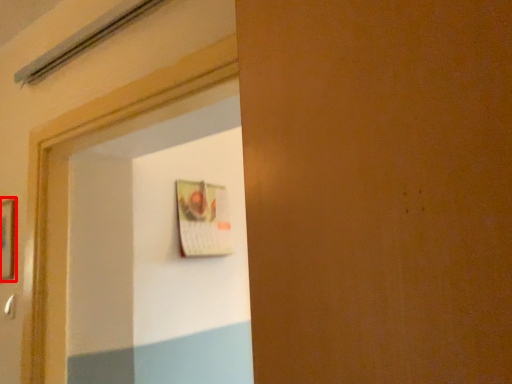
Question: From the image's perspective, considering the relative positions of picture frame (annotated by the red box) and door handle in the image provided, where is picture frame (annotated by the red box) located with respect to the staircase?

Choices:
 (A) above
 (B) below

Answer: (A)